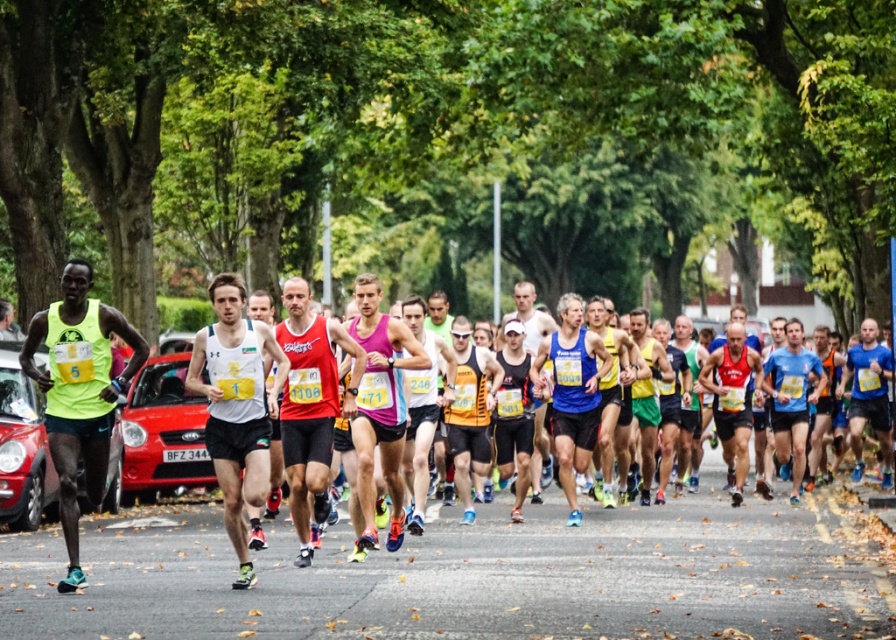
You are a photographer positioned at the side of the road during a marathon. You want to capture a photo of both the blue fabric shirt at center and the black mesh tank top at center. Which runner should you focus on first if you want to include both in your frame without zooming in?

The blue fabric shirt at center is not as tall as the black mesh tank top at center, so you should focus on the black mesh tank top at center first to ensure both are in frame without zooming.